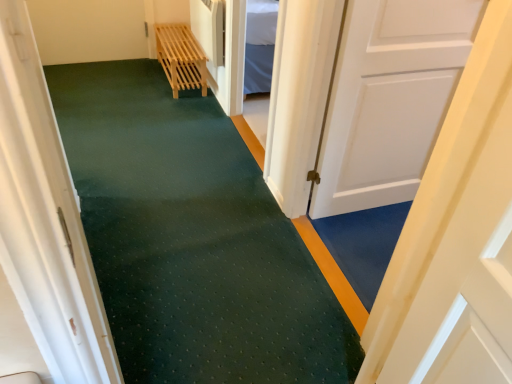
Question: Can you confirm if white matte door at center, placed as the first door when sorted from left to right, is thinner than white matte door at right, which appears as the first door when viewed from the right?

Choices:
 (A) no
 (B) yes

Answer: (A)

Question: Can you confirm if white matte door at center, placed as the first door when sorted from left to right, is wider than white matte door at right, which is the 2th door in left-to-right order?

Choices:
 (A) no
 (B) yes

Answer: (B)

Question: Does white matte door at center, placed as the first door when sorted from left to right, have a lesser height compared to white matte door at right, which is the 2th door in left-to-right order?

Choices:
 (A) no
 (B) yes

Answer: (A)

Question: From the image's perspective, is white matte door at center, placed as the first door when sorted from left to right, on white matte door at right, which appears as the first door when viewed from the right?

Choices:
 (A) no
 (B) yes

Answer: (A)

Question: Can you confirm if white matte door at center, placed as the first door when sorted from left to right, is positioned to the left of white matte door at right, which is the 2th door in left-to-right order?

Choices:
 (A) yes
 (B) no

Answer: (A)

Question: Is white matte door at center, the second door viewed from the right, turned away from white matte door at right, which is the 2th door in left-to-right order?

Choices:
 (A) no
 (B) yes

Answer: (B)

Question: Is white matte door at right, which is the 2th door in left-to-right order, in contact with light wood slatted bench at upper center?

Choices:
 (A) yes
 (B) no

Answer: (B)

Question: Can you confirm if white matte door at right, which appears as the first door when viewed from the right, is positioned to the right of light wood slatted bench at upper center?

Choices:
 (A) yes
 (B) no

Answer: (A)

Question: Does white matte door at right, which appears as the first door when viewed from the right, have a larger size compared to light wood slatted bench at upper center?

Choices:
 (A) yes
 (B) no

Answer: (B)

Question: From a real-world perspective, does white matte door at right, which is the 2th door in left-to-right order, stand above light wood slatted bench at upper center?

Choices:
 (A) no
 (B) yes

Answer: (B)

Question: Is white matte door at right, which appears as the first door when viewed from the right, positioned before light wood slatted bench at upper center?

Choices:
 (A) no
 (B) yes

Answer: (B)

Question: Is white matte door at right, which is the 2th door in left-to-right order, taller than light wood slatted bench at upper center?

Choices:
 (A) no
 (B) yes

Answer: (B)

Question: Considering the relative sizes of light wood slatted bench at upper center and white matte door at center, the second door viewed from the right, in the image provided, is light wood slatted bench at upper center thinner than white matte door at center, the second door viewed from the right,?

Choices:
 (A) no
 (B) yes

Answer: (A)